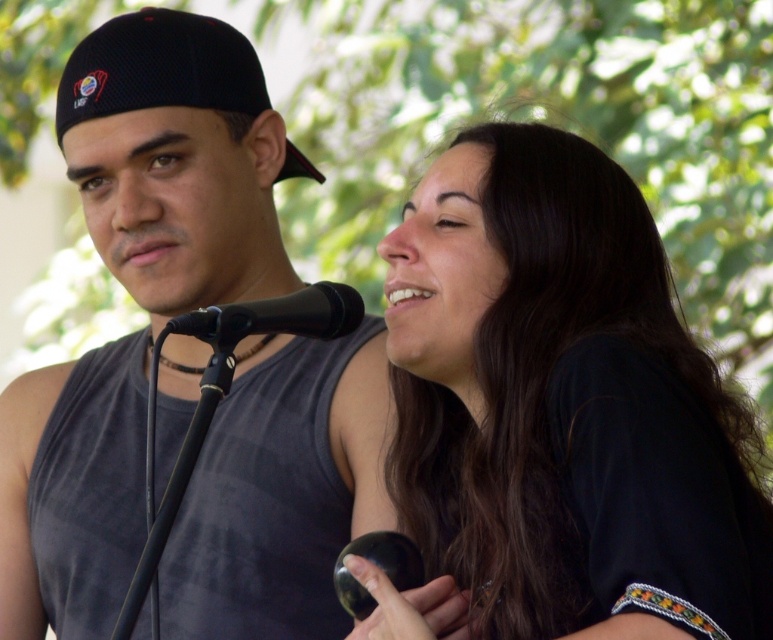
Question: Which of the following is the farthest from the observer?

Choices:
 (A) black matte microphone at center
 (B) black matte hair at upper right
 (C) black matte tank top at center
 (D) black mesh baseball cap at upper left

Answer: (D)

Question: Among these objects, which one is farthest from the camera?

Choices:
 (A) black matte tank top at center
 (B) black matte hair at upper right
 (C) black matte microphone at center

Answer: (A)

Question: Is black matte tank top at center thinner than black matte microphone at center?

Choices:
 (A) no
 (B) yes

Answer: (A)

Question: Considering the relative positions of black matte hair at upper right and black matte microphone at center in the image provided, where is black matte hair at upper right located with respect to black matte microphone at center?

Choices:
 (A) right
 (B) left

Answer: (A)

Question: Is black matte tank top at center to the left of black mesh baseball cap at upper left from the viewer's perspective?

Choices:
 (A) no
 (B) yes

Answer: (B)

Question: Which point is closer to the camera?

Choices:
 (A) black matte tank top at center
 (B) black matte hair at upper right
 (C) black mesh baseball cap at upper left

Answer: (B)